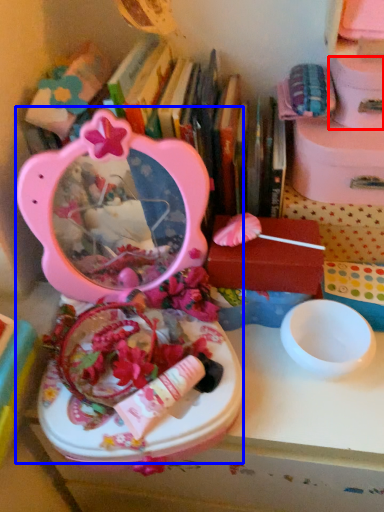
Question: Which point is closer to the camera, storage box (highlighted by a red box) or toy (highlighted by a blue box)?

Choices:
 (A) storage box
 (B) toy

Answer: (B)